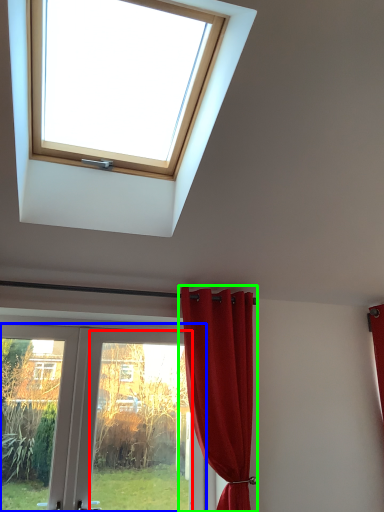
Question: Which is farther away from glass door (highlighted by a red box)? door (highlighted by a blue box) or curtain (highlighted by a green box)?

Choices:
 (A) door
 (B) curtain

Answer: (B)